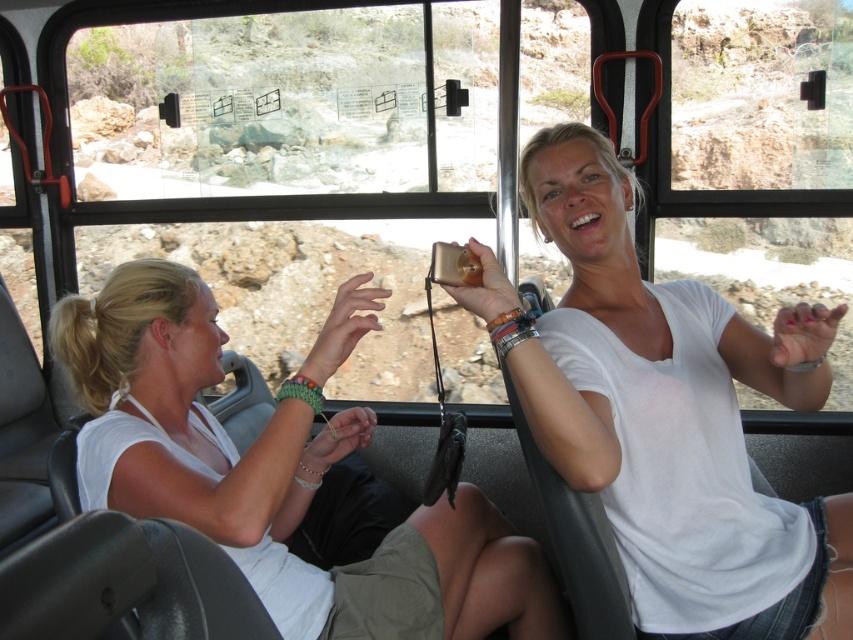
You are standing in front of a bus window and see the white cotton shirt at center. If you want to reach out and touch it, will you be able to do so without moving your position?

The white cotton shirt at center is 3.69 feet away from viewer, so yes, you can reach out and touch it without moving your position since the distance is within arm length.

You are a photographer standing in the center of the bus. You want to take a photo of both the white cotton shirt at center and the white matte shirt at center without any overlap. Given that your camera has a maximum focus range of 20 inches, can you capture both subjects in the same frame without moving closer or farther away?

The distance between the white cotton shirt at center and the white matte shirt at center is 20.36 inches. Since the camera can only focus within 20 inches, the subjects are slightly beyond the range, so you cannot capture both in the same frame without adjusting your position.